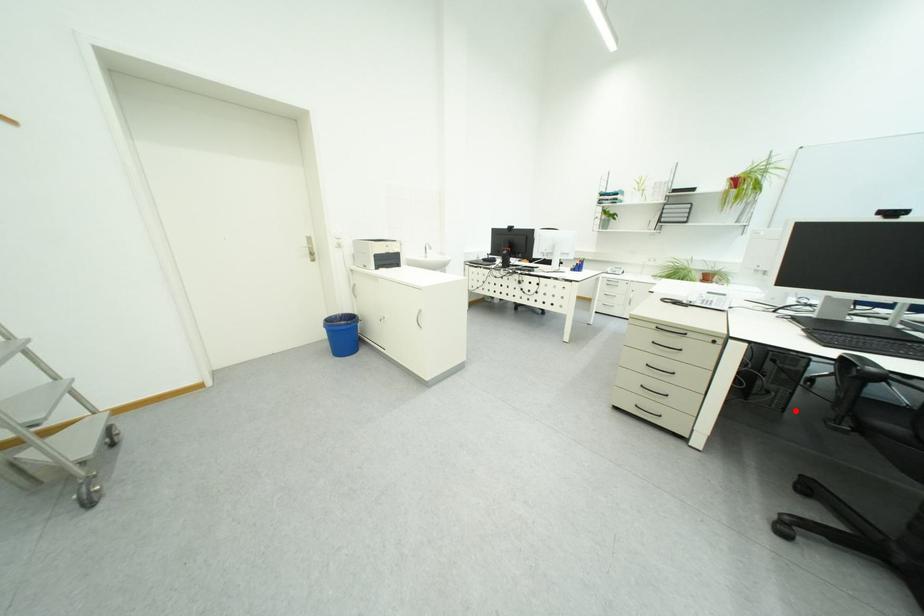
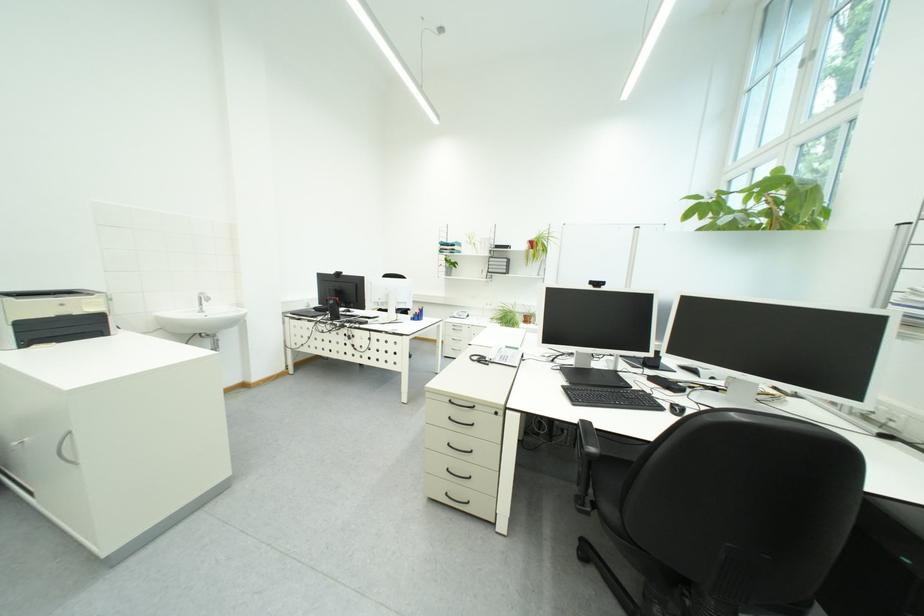
Question: I am providing you with two images of the same scene from different viewpoints. Image1 has a red point marked. In image2, the corresponding 3D location appears at what relative position? Reply with the corresponding letter.

Choices:
 (A) Closer
 (B) Farther

Answer: (A)